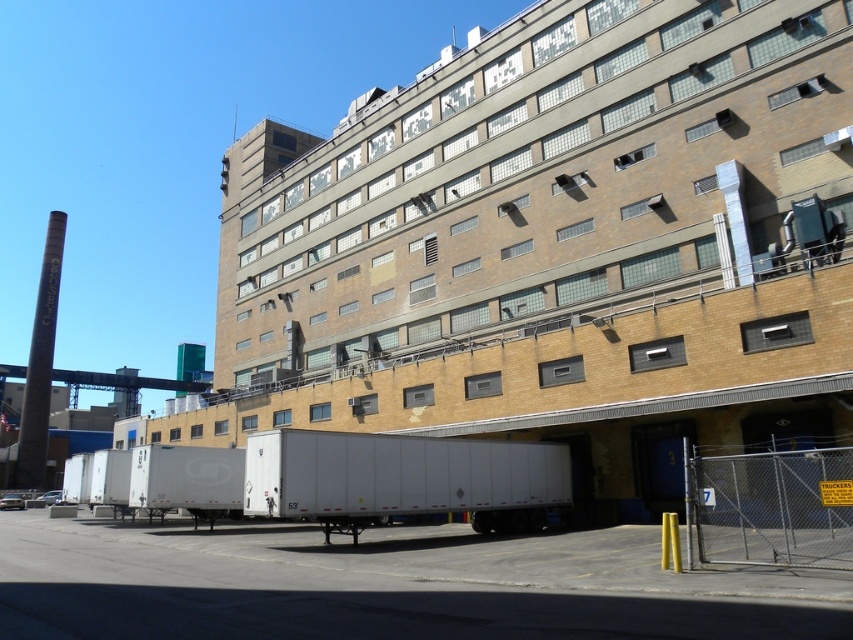
Question: Which object appears farthest from the camera in this image?

Choices:
 (A) white matte trailer at lower center
 (B) white matte trailer truck at center

Answer: (A)

Question: Can you confirm if white matte trailer at lower center is thinner than white matte trailer truck at center?

Choices:
 (A) no
 (B) yes

Answer: (A)

Question: Is white matte trailer at lower center to the right of white matte trailer truck at center from the viewer's perspective?

Choices:
 (A) no
 (B) yes

Answer: (A)

Question: Can you confirm if white matte trailer at lower center is positioned above white matte trailer truck at center?

Choices:
 (A) no
 (B) yes

Answer: (B)